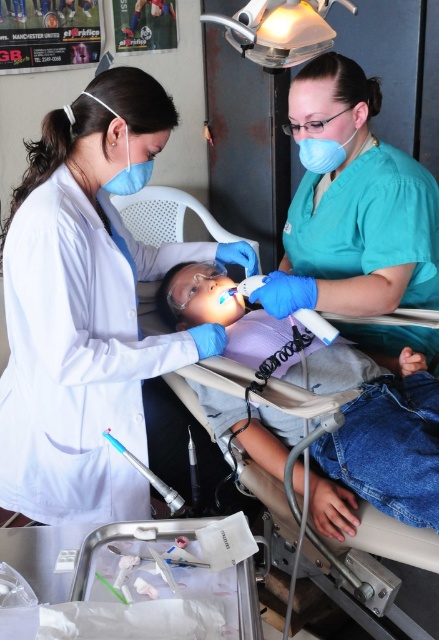
Question: Which point is farther from the camera taking this photo?

Choices:
 (A) (169, 496)
 (B) (51, 321)
 (C) (147, 173)

Answer: (C)

Question: Which object is closer to the camera taking this photo?

Choices:
 (A) white matte lab coat at upper left
 (B) smooth purple shirt at center
 (C) matte blue mask at upper left

Answer: (B)

Question: Does white matte lab coat at upper left appear over smooth purple shirt at center?

Choices:
 (A) yes
 (B) no

Answer: (A)

Question: Does white matte lab coat at upper left have a greater width compared to blue fabric mask at upper center?

Choices:
 (A) no
 (B) yes

Answer: (B)

Question: Which point is farther from the camera taking this photo?

Choices:
 (A) (47, 116)
 (B) (321, 170)

Answer: (B)

Question: Considering the relative positions of blue smooth dental chair at center and translucent plastic dental tool at center in the image provided, where is blue smooth dental chair at center located with respect to translucent plastic dental tool at center?

Choices:
 (A) below
 (B) above

Answer: (B)